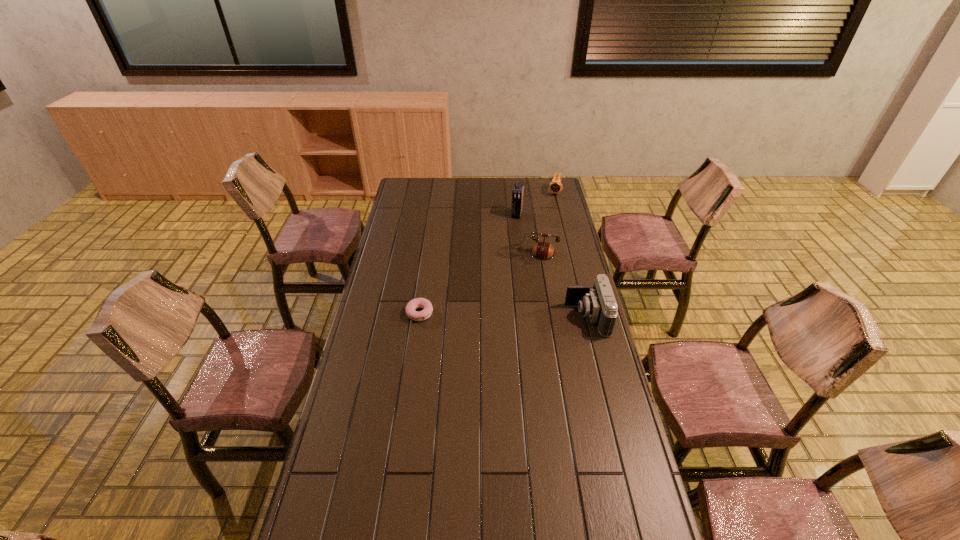
What are the coordinates of `vacant position located at the front of the fourth shortest object with an open lens cover` in the screenshot? It's located at (464, 317).

Image resolution: width=960 pixels, height=540 pixels. I want to click on vacant space located 0.100m on the face of the watch, so click(x=551, y=207).

The image size is (960, 540). I want to click on free space located 0.170m on the face of the watch, so 549,214.

Image resolution: width=960 pixels, height=540 pixels. I want to click on free spot located on the face of the watch, so click(x=547, y=218).

You are a GUI agent. You are given a task and a screenshot of the screen. Output one action in this format:
    pyautogui.click(x=<x>, y=<y>)
    Task: Click on the vacant space located on the rotary dial of the third nearest object
    
    Given the screenshot: What is the action you would take?
    pyautogui.click(x=510, y=303)

Locate an element on the screen. vacant space situated 0.180m on the rotary dial of the third nearest object is located at coordinates (514, 290).

Where is `free space located 0.290m on the rotary dial of the third nearest object`? Image resolution: width=960 pixels, height=540 pixels. free space located 0.290m on the rotary dial of the third nearest object is located at coordinates (509, 308).

The image size is (960, 540). Find the location of `vacant area situated with the zip open on the fourth nearest object`. vacant area situated with the zip open on the fourth nearest object is located at coordinates (509, 240).

I want to click on vacant space located 0.160m with the zip open on the fourth nearest object, so click(509, 239).

Locate an element on the screen. free space located 0.210m with the zip open on the fourth nearest object is located at coordinates (507, 245).